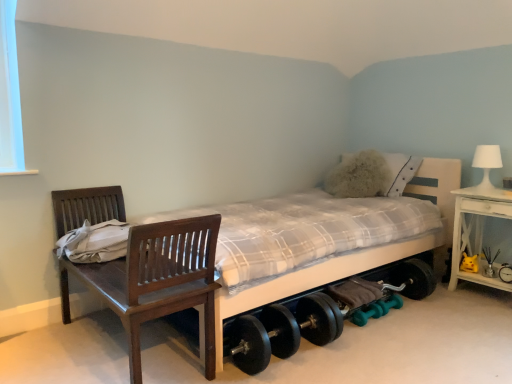
Question: In the image, is white matte table lamp at upper right positioned in front of or behind yellow plush toy at lower right?

Choices:
 (A) front
 (B) behind

Answer: (A)

Question: From a real-world perspective, is white matte table lamp at upper right above or below yellow plush toy at lower right?

Choices:
 (A) below
 (B) above

Answer: (B)

Question: Which of these objects is positioned farthest from the black rubber dumbbell at lower right, which is the 1th dumbbell from top to bottom?

Choices:
 (A) white plaid fabric bed at center
 (B) white wood nightstand at right
 (C) green rubber dumbbell at lower center, positioned as the 2th dumbbell in top-to-bottom order
 (D) yellow plush toy at lower right
 (E) wooden chair at left

Answer: (E)

Question: Estimate the real-world distances between objects in this image. Which object is closer to the white matte table lamp at upper right?

Choices:
 (A) black rubber dumbbell at lower right, marked as the 3th dumbbell in a left-to-right arrangement
 (B) yellow plush toy at lower right
 (C) wooden chair at left
 (D) white wood nightstand at right
 (E) green rubber dumbbell at lower center, positioned as the 2th dumbbell in top-to-bottom order

Answer: (D)